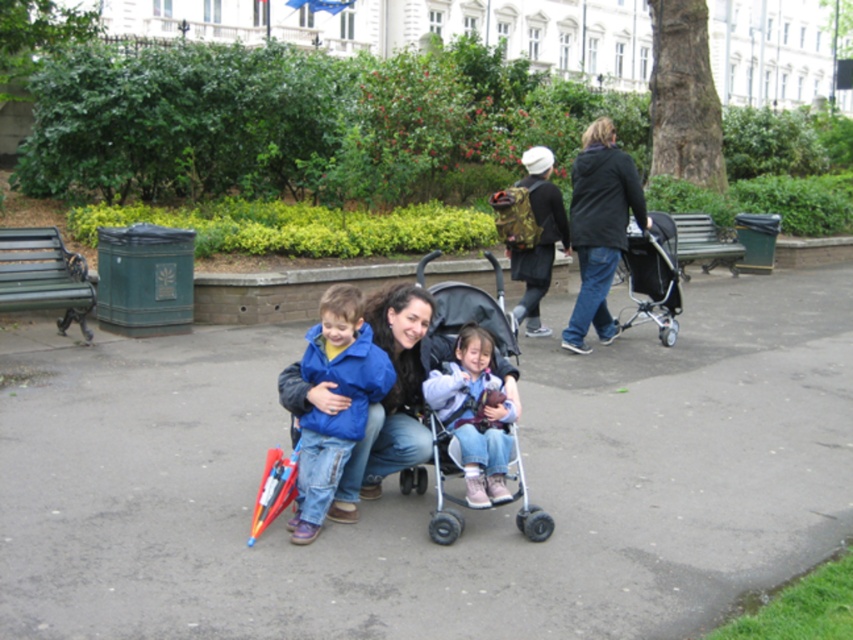
Question: Which object is closer to the camera taking this photo?

Choices:
 (A) black matte jacket at upper center
 (B) gray asphalt pavement at center
 (C) green wooden bench at center
 (D) pink suede boots at center

Answer: (B)

Question: Can you confirm if black matte jacket at upper center is smaller than green painted wood park bench at left?

Choices:
 (A) no
 (B) yes

Answer: (A)

Question: Is blue matte jacket at center to the right of black matte jacket at upper center from the viewer's perspective?

Choices:
 (A) no
 (B) yes

Answer: (A)

Question: Which point is farther to the camera?

Choices:
 (A) pink suede boots at center
 (B) green painted wood park bench at left
 (C) camouflage backpack at upper center

Answer: (C)

Question: Which of the following is the farthest from the observer?

Choices:
 (A) (61, 326)
 (B) (589, 141)
 (C) (660, 304)

Answer: (C)

Question: Can you confirm if gray asphalt pavement at center is wider than green wooden bench at center?

Choices:
 (A) yes
 (B) no

Answer: (A)